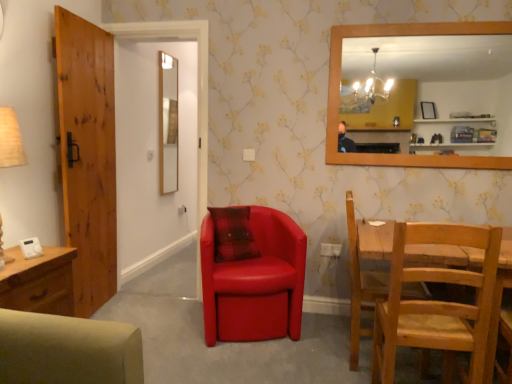
Question: In the image, is wooden door at left positioned in front of or behind light brown wooden chair at lower right, positioned as the 1th chair in right-to-left order?

Choices:
 (A) front
 (B) behind

Answer: (B)

Question: Looking at their shapes, would you say wooden door at left is wider or thinner than light brown wooden chair at lower right, arranged as the 2th chair when viewed from the left?

Choices:
 (A) thin
 (B) wide

Answer: (A)

Question: Based on their relative distances, which object is farther from the light brown wooden chair at lower right, positioned as the 1th chair in right-to-left order?

Choices:
 (A) beige paper table lamp at left
 (B) smooth wooden mirror at center, which appears as the first mirror when viewed from the left
 (C) wooden door at left
 (D) wooden frame mirror at upper right, the second mirror in the left-to-right sequence
 (E) matte red leather armchair at center, which is the first chair from left to right

Answer: (D)

Question: Estimate the real-world distances between objects in this image. Which object is closer to the matte red leather armchair at center, the 2th chair viewed from the right?

Choices:
 (A) light brown wooden chair at lower right, positioned as the 1th chair in right-to-left order
 (B) smooth wooden mirror at center, the second mirror from the right
 (C) beige paper table lamp at left
 (D) wooden frame mirror at upper right, the second mirror in the left-to-right sequence
 (E) wooden door at left

Answer: (A)